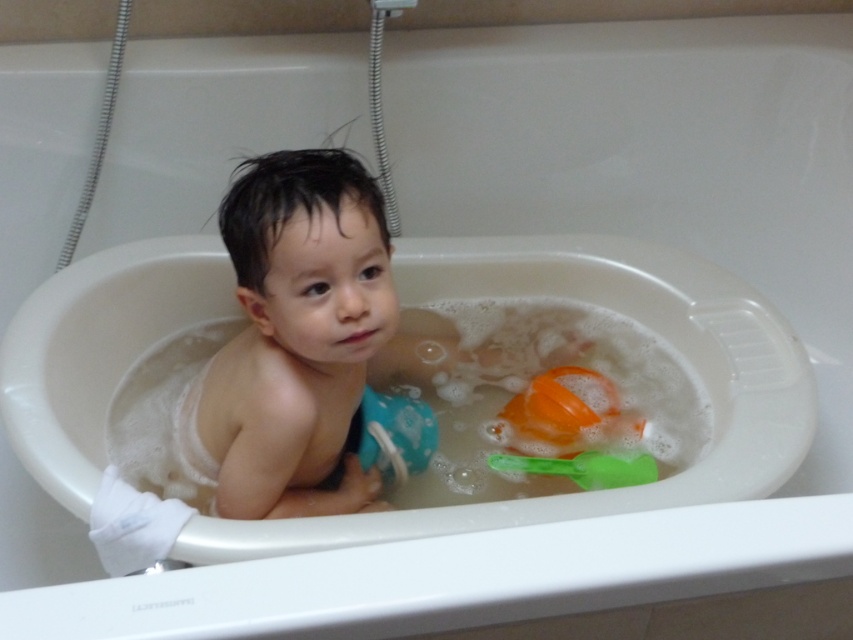
Question: Can you confirm if smooth skin baby at center is positioned above green plastic spoon at lower right?

Choices:
 (A) yes
 (B) no

Answer: (A)

Question: Which object appears closest to the camera in this image?

Choices:
 (A) smooth skin baby at center
 (B) green plastic spoon at lower right

Answer: (A)

Question: Can you confirm if smooth skin baby at center is positioned to the left of green plastic spoon at lower right?

Choices:
 (A) yes
 (B) no

Answer: (A)

Question: From the image, what is the correct spatial relationship of smooth skin baby at center in relation to green plastic spoon at lower right?

Choices:
 (A) below
 (B) above

Answer: (B)